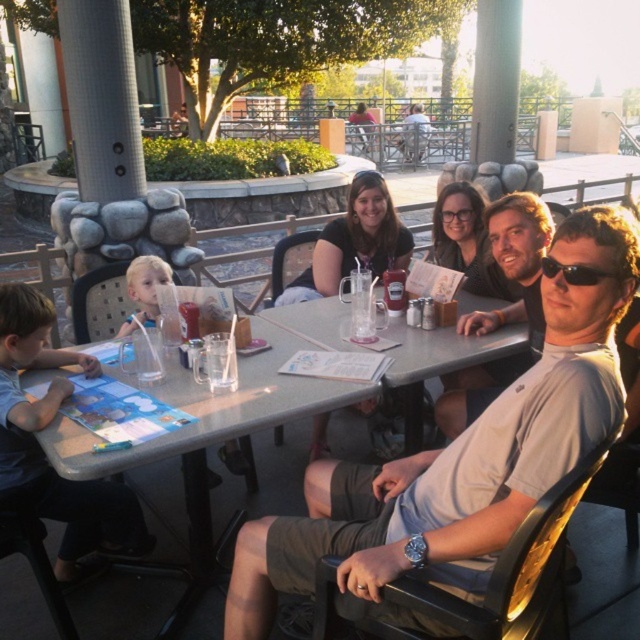
You are a waiter at the outdoor dining area. You need to place a new menu on the table. The existing menu is the light blue paper at lower left. Where should you place the new menu so it doesn t overlap with the black plastic sunglasses at center?

Result: Since the light blue paper at lower left is larger than the black plastic sunglasses at center, you can place the new menu on the larger light blue paper at lower left without overlapping the sunglasses.

You are a photographer taking a picture of the dining table. You notice two points marked on the table surface. The first point is at coordinate (83, 515) and the second is at (568, 268). If you want to focus on the point closer to the camera, which coordinate should you adjust your camera to aim at?

The point at coordinate (83, 515) is further to the camera than point (568, 268). Wait, the question says the first point is further, so the closer one is the second point. Hmm, need to check the description again. The Objects Description says point (83, 515) is further than (568, 268). So the closer point is (568, 268). Therefore, the answer should be to aim at (568, 268). But the question asks for the point closer to the camera, so the answer is the second point. Let me rephrase that clearly